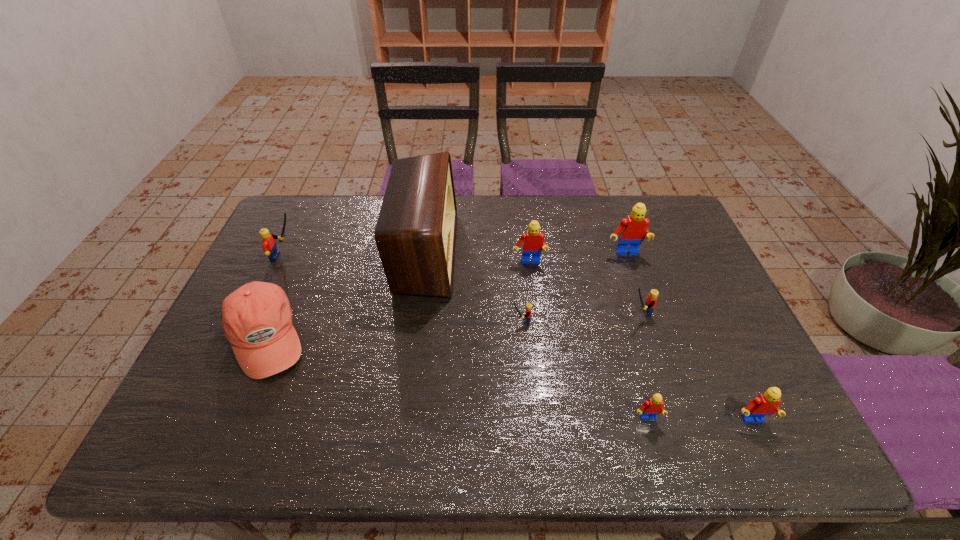
Locate an element on the screen. Image resolution: width=960 pixels, height=540 pixels. vacant region located on the front-facing side of the second smallest yellow Lego is located at coordinates 514,312.

Locate an element on the screen. The width and height of the screenshot is (960, 540). vacant space located on the front-facing side of the smallest yellow Lego is located at coordinates (460, 320).

Image resolution: width=960 pixels, height=540 pixels. Find the location of `free space located on the front-facing side of the smallest yellow Lego`. free space located on the front-facing side of the smallest yellow Lego is located at coordinates (405, 320).

You are a GUI agent. You are given a task and a screenshot of the screen. Output one action in this format:
    pyautogui.click(x=<x>, y=<y>)
    Task: Click on the blank space located 0.130m on the front-facing side of the smallest yellow Lego
    Image resolution: width=960 pixels, height=540 pixels.
    Given the screenshot: What is the action you would take?
    pyautogui.click(x=464, y=320)

Where is `object that is at the far edge`? This screenshot has height=540, width=960. object that is at the far edge is located at coordinates (415, 234).

The height and width of the screenshot is (540, 960). I want to click on Lego that is positioned at the left edge, so click(x=268, y=243).

Locate an element on the screen. The width and height of the screenshot is (960, 540). baseball cap positioned at the left edge is located at coordinates (257, 318).

Identify the location of object positioned at the right edge. (766, 404).

Identify the location of object at the near right corner. The image size is (960, 540). (766, 404).

In the image, there is a desktop. Where is `free space at the far edge`? This screenshot has height=540, width=960. free space at the far edge is located at coordinates (529, 194).